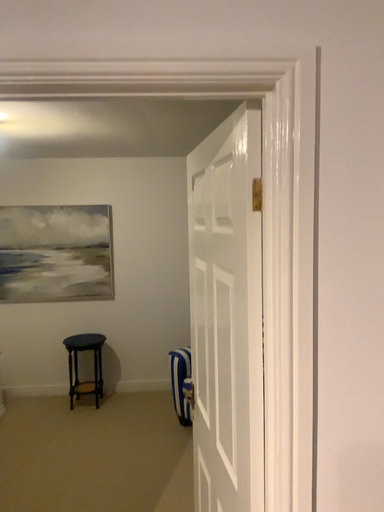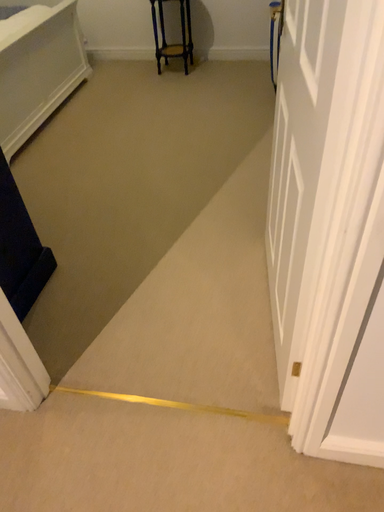
Question: How did the camera likely rotate when shooting the video?

Choices:
 (A) rotated downward
 (B) rotated upward

Answer: (A)